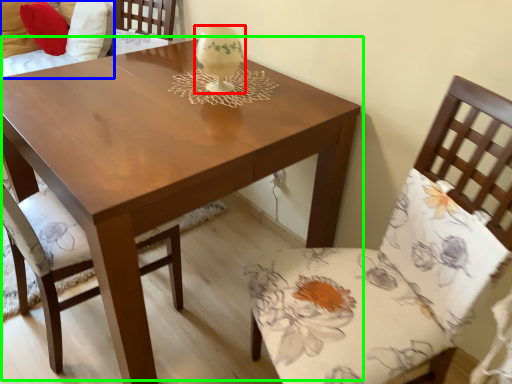
Question: Considering the real-world distances, which object is closest to candle holder (highlighted by a red box)? couch (highlighted by a blue box) or coffee table (highlighted by a green box).

Choices:
 (A) couch
 (B) coffee table

Answer: (B)